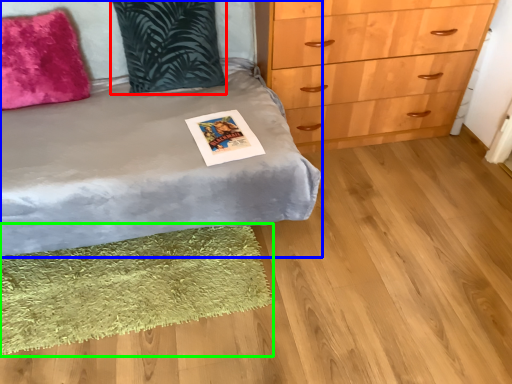
Question: Based on their relative distances, which object is farther from pillow (highlighted by a red box)? Choose from bed (highlighted by a blue box) and mat (highlighted by a green box).

Choices:
 (A) bed
 (B) mat

Answer: (B)